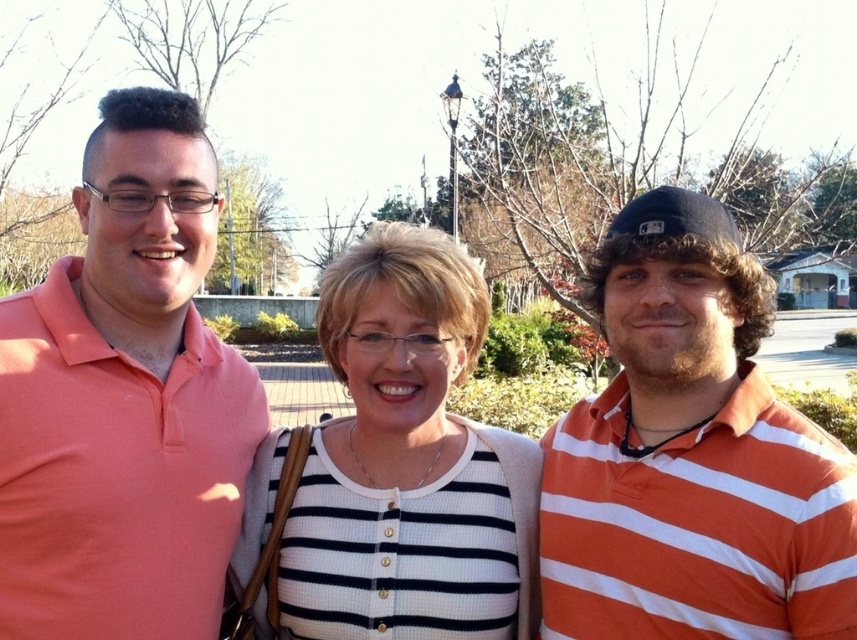
You are standing facing the three people in the image. The orange striped polo shirt at right and the white striped sweater at center are in your view. Which one is positioned more to your right side?

The orange striped polo shirt at right is positioned to the right of the white striped sweater at center, so it is more to your right side.

You are a fashion designer observing the three people in the image. You need to decide which clothing item, the matte coral polo shirt at left or the white striped sweater at center, would be more suitable for a slim body type. Based on the visual information provided, which one would you recommend?

The matte coral polo shirt at left is thinner than the white striped sweater at center, so it would be more suitable for a slim body type.